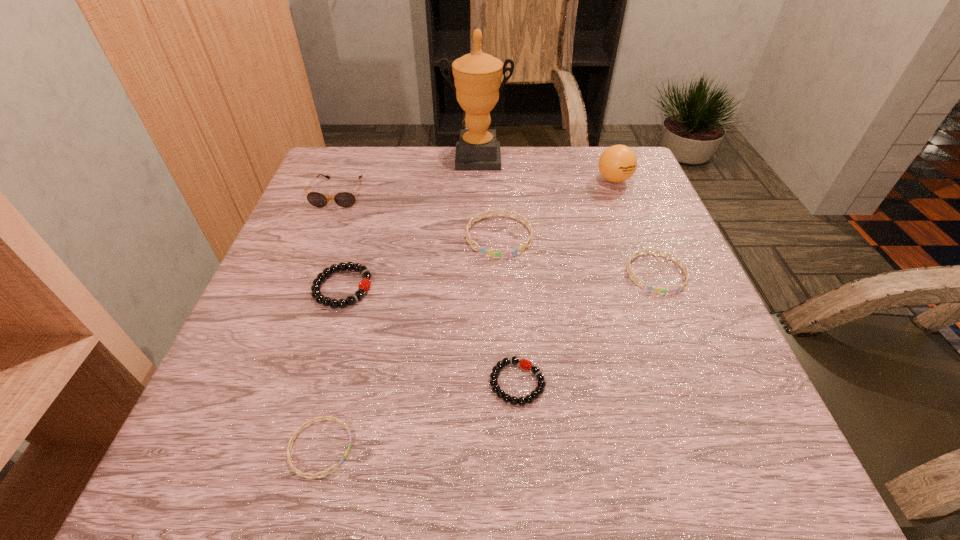
Find the location of a particular element. The height and width of the screenshot is (540, 960). object at the near left corner is located at coordinates (302, 474).

Identify the location of object present at the far right corner. This screenshot has width=960, height=540. (617, 163).

This screenshot has height=540, width=960. What are the coordinates of `free region at the far edge of the desktop` in the screenshot? It's located at (419, 186).

Image resolution: width=960 pixels, height=540 pixels. Find the location of `vacant space at the near edge`. vacant space at the near edge is located at coordinates (427, 469).

The image size is (960, 540). I want to click on free space at the left edge of the desktop, so click(x=288, y=339).

In the image, there is a desktop. Where is `vacant space at the right edge`? This screenshot has width=960, height=540. vacant space at the right edge is located at coordinates (676, 340).

This screenshot has height=540, width=960. I want to click on blank space at the far left corner of the desktop, so click(x=322, y=160).

You are a GUI agent. You are given a task and a screenshot of the screen. Output one action in this format:
    pyautogui.click(x=<x>, y=<y>)
    Task: Click on the vacant area at the far right corner
    This screenshot has width=960, height=540.
    Given the screenshot: What is the action you would take?
    pyautogui.click(x=629, y=193)

In the image, there is a desktop. At what (x,y) coordinates should I click in order to perform the action: click on vacant space at the near right corner. Please return your answer as a coordinate pair (x, y). The image size is (960, 540). Looking at the image, I should click on (765, 440).

I want to click on empty space that is in between the golden award and the shortest bracelet, so click(398, 303).